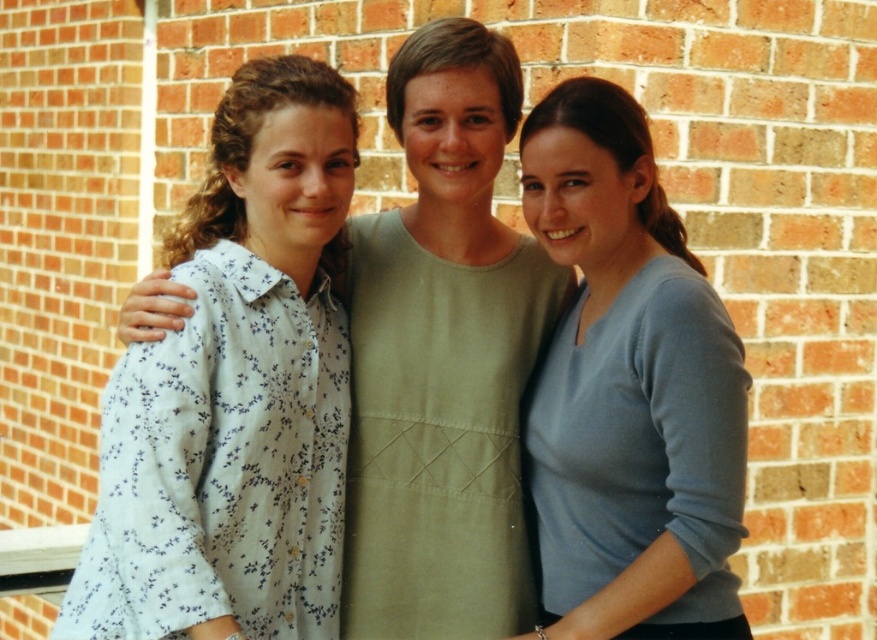
Question: Does white floral shirt at left come in front of light green fabric dress at center?

Choices:
 (A) yes
 (B) no

Answer: (A)

Question: Which of the following is the farthest from the observer?

Choices:
 (A) 661,214
 (B) 289,291
 (C) 428,49

Answer: (C)

Question: Does white floral shirt at left appear over light blue sweater at center?

Choices:
 (A) yes
 (B) no

Answer: (B)

Question: Which object appears farthest from the camera in this image?

Choices:
 (A) light green fabric dress at center
 (B) white floral shirt at left

Answer: (A)

Question: Can you confirm if light green fabric dress at center is bigger than light blue sweater at center?

Choices:
 (A) no
 (B) yes

Answer: (A)

Question: Based on their relative distances, which object is farther from the light green fabric dress at center?

Choices:
 (A) white floral shirt at left
 (B) light blue sweater at center

Answer: (A)